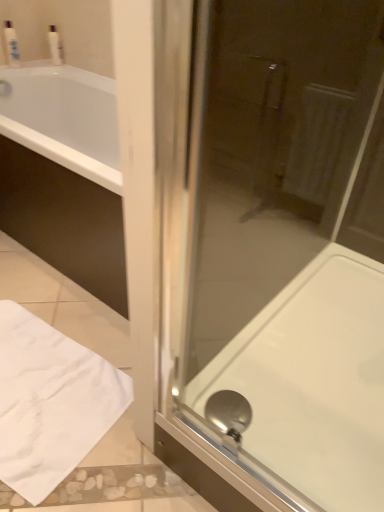
Question: From the image's perspective, is white glossy bath at center below transparent glass shower door at center?

Choices:
 (A) no
 (B) yes

Answer: (B)

Question: Does white glossy bath at center have a greater width compared to transparent glass shower door at center?

Choices:
 (A) yes
 (B) no

Answer: (A)

Question: Is white glossy bath at center further to camera compared to transparent glass shower door at center?

Choices:
 (A) no
 (B) yes

Answer: (B)

Question: Does white glossy bath at center contain transparent glass shower door at center?

Choices:
 (A) no
 (B) yes

Answer: (A)

Question: From the image's perspective, would you say white glossy bath at center is positioned over transparent glass shower door at center?

Choices:
 (A) no
 (B) yes

Answer: (A)

Question: Relative to white glossy bottle at upper left, the first toiletry viewed from the right, is transparent glass shower door at center in front or behind?

Choices:
 (A) behind
 (B) front

Answer: (B)

Question: In terms of size, does transparent glass shower door at center appear bigger or smaller than white glossy bottle at upper left, the first toiletry viewed from the right?

Choices:
 (A) big
 (B) small

Answer: (A)

Question: Would you say transparent glass shower door at center is to the left or to the right of white glossy bottle at upper left, the 2th toiletry positioned from the left, in the picture?

Choices:
 (A) left
 (B) right

Answer: (B)

Question: From the image's perspective, is transparent glass shower door at center positioned above or below white glossy bottle at upper left, the first toiletry viewed from the right?

Choices:
 (A) above
 (B) below

Answer: (B)

Question: From the image's perspective, relative to white plastic bottle at upper left, the first toiletry viewed from the left, is white glossy bath at center above or below?

Choices:
 (A) above
 (B) below

Answer: (B)

Question: Does point (380, 348) appear closer or farther from the camera than point (9, 25)?

Choices:
 (A) farther
 (B) closer

Answer: (B)

Question: Considering their positions, is white glossy bath at center located in front of or behind white plastic bottle at upper left, the first toiletry viewed from the left?

Choices:
 (A) behind
 (B) front

Answer: (B)

Question: From a real-world perspective, is white glossy bath at center above or below white plastic bottle at upper left, which appears as the second toiletry when viewed from the right?

Choices:
 (A) above
 (B) below

Answer: (B)

Question: Based on their sizes in the image, would you say white fabric towel at lower left is bigger or smaller than white glossy bottle at upper left, the 2th toiletry positioned from the left?

Choices:
 (A) big
 (B) small

Answer: (A)

Question: From the image's perspective, is white fabric towel at lower left located above or below white glossy bottle at upper left, the first toiletry viewed from the right?

Choices:
 (A) below
 (B) above

Answer: (A)